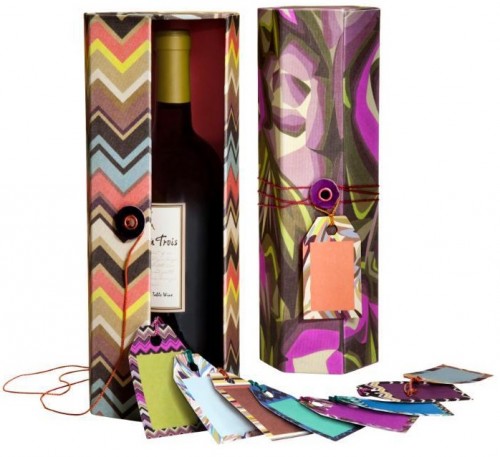
This screenshot has height=457, width=500. I want to click on red interior of gift box, so click(154, 80), click(194, 78).